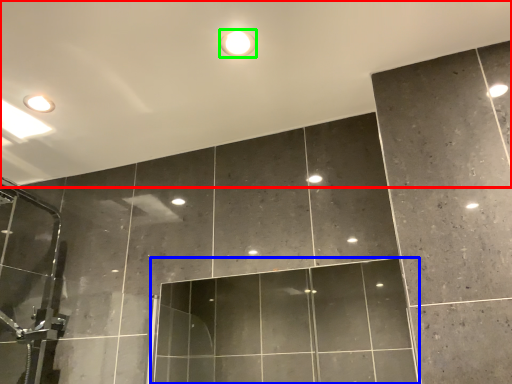
Question: Based on their relative distances, which object is nearer to backdrop (highlighted by a red box)? Choose from glass door (highlighted by a blue box) and droplight (highlighted by a green box).

Choices:
 (A) glass door
 (B) droplight

Answer: (B)